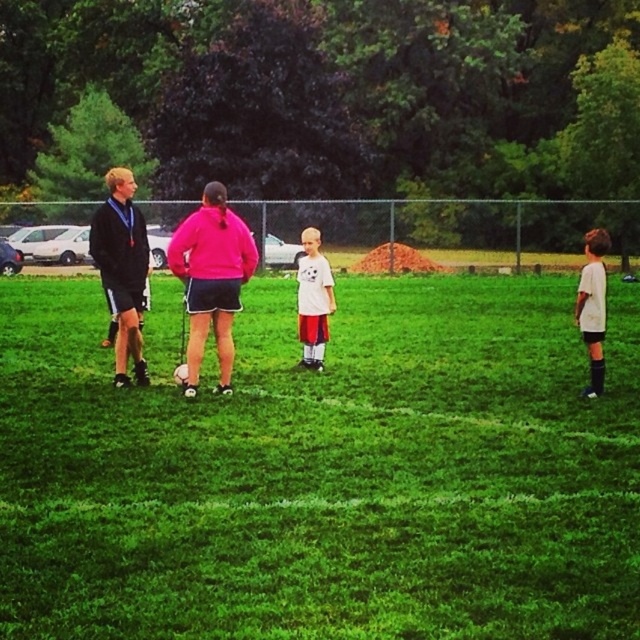
You are a photographer trying to capture a photo of the white matte shirt at right and the green grass at center. Based on the scene description, which object is positioned lower in the image?

The green grass at center is positioned lower than the white matte shirt at right in the image.